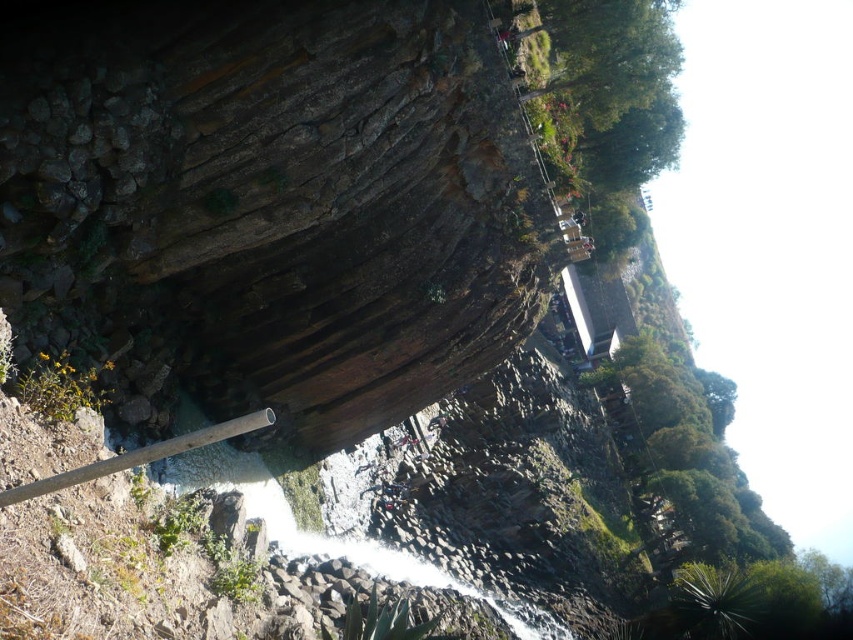
Question: Is brown rough rock at center above white frothy water at center?

Choices:
 (A) yes
 (B) no

Answer: (A)

Question: Is brown rough rock at center below white frothy water at center?

Choices:
 (A) no
 (B) yes

Answer: (A)

Question: Which of the following is the closest to the observer?

Choices:
 (A) (141, 64)
 (B) (534, 605)

Answer: (A)

Question: Among these objects, which one is nearest to the camera?

Choices:
 (A) brown rough rock at center
 (B) white frothy water at center

Answer: (A)

Question: Which of the following is the closest to the observer?

Choices:
 (A) brown rough rock at center
 (B) white frothy water at center

Answer: (A)

Question: Is brown rough rock at center above white frothy water at center?

Choices:
 (A) yes
 (B) no

Answer: (A)